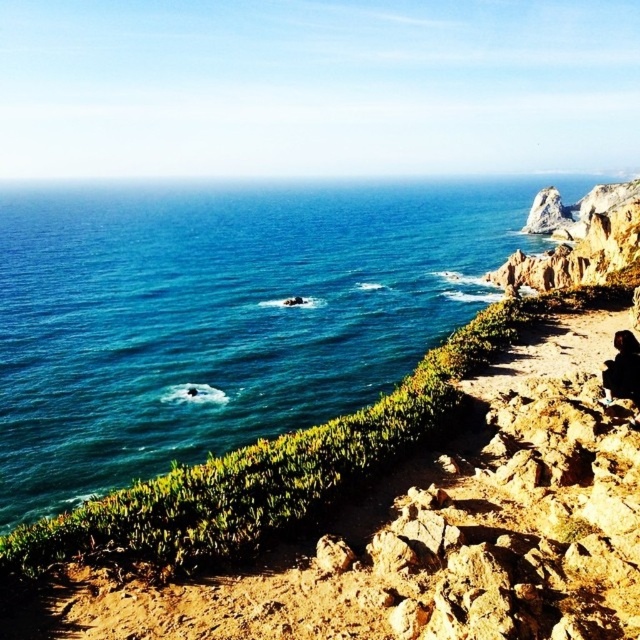
You are standing on the rocky coast and see the blue water at upper left and the dark hair at lower right. Which object takes up more space in the image?

The blue water at upper left takes up more space in the image than the dark hair at lower right because it is bigger.

You are standing at the center of the coastal landscape and want to locate the dark hair at lower right. In terms of direction, where should you look relative to your position?

Since the dark hair at lower right is located at point 0.578 on the x axis and 0.973 on the y axis, you should look to the lower right direction from your current position at the center.